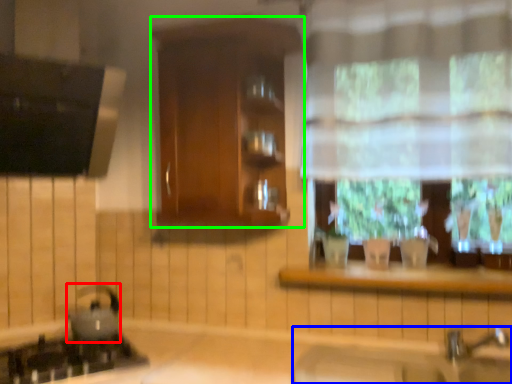
Question: Considering the real-world distances, which object is farthest from appliance (highlighted by a red box)? sink (highlighted by a blue box) or cabinetry (highlighted by a green box)?

Choices:
 (A) sink
 (B) cabinetry

Answer: (A)